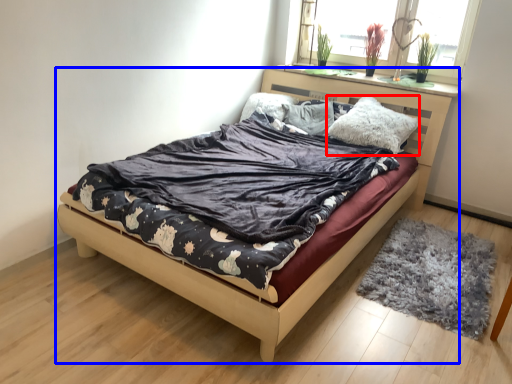
Question: Which of the following is the farthest to the observer, pillow (highlighted by a red box) or bed (highlighted by a blue box)?

Choices:
 (A) pillow
 (B) bed

Answer: (A)